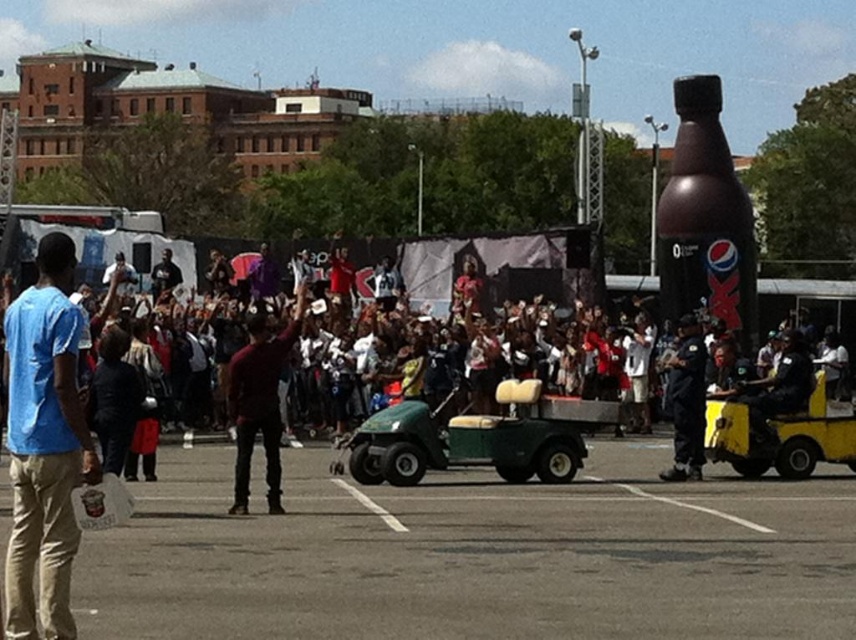
Can you confirm if gray asphalt parking lot at lower center is positioned below blue cotton shirt at left?

Indeed, gray asphalt parking lot at lower center is positioned under blue cotton shirt at left.

Is gray asphalt parking lot at lower center behind blue cotton shirt at left?

That is True.

Describe the element at coordinates (474, 556) in the screenshot. The image size is (856, 640). I see `gray asphalt parking lot at lower center` at that location.

Locate an element on the screen. Image resolution: width=856 pixels, height=640 pixels. gray asphalt parking lot at lower center is located at coordinates (474, 556).

What do you see at coordinates (779, 435) in the screenshot? This screenshot has height=640, width=856. I see `yellow plastic cart at right` at bounding box center [779, 435].

Is yellow plastic cart at right bigger than maroon fabric shirt at center?

Correct, yellow plastic cart at right is larger in size than maroon fabric shirt at center.

Which is behind, point (849, 422) or point (275, 397)?

The point (849, 422) is behind.

The height and width of the screenshot is (640, 856). I want to click on yellow plastic cart at right, so click(x=779, y=435).

Does yellow plastic cart at right have a lesser width compared to black uniformed officer at center?

Incorrect, yellow plastic cart at right's width is not less than black uniformed officer at center's.

You are a GUI agent. You are given a task and a screenshot of the screen. Output one action in this format:
    pyautogui.click(x=<x>, y=<y>)
    Task: Click on the yellow plastic cart at right
    
    Given the screenshot: What is the action you would take?
    pyautogui.click(x=779, y=435)